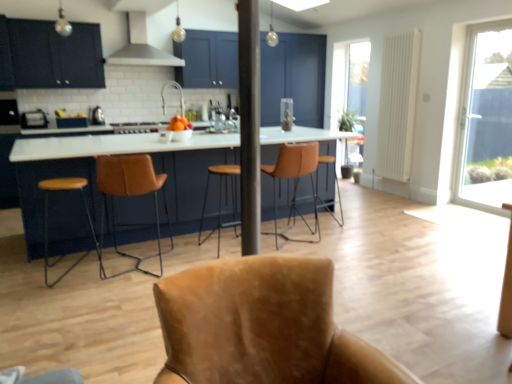
Locate an element on the screen. free space to the left of brown leather bar stool at center, the 2th bar stool positioned from the back is located at coordinates pyautogui.click(x=183, y=243).